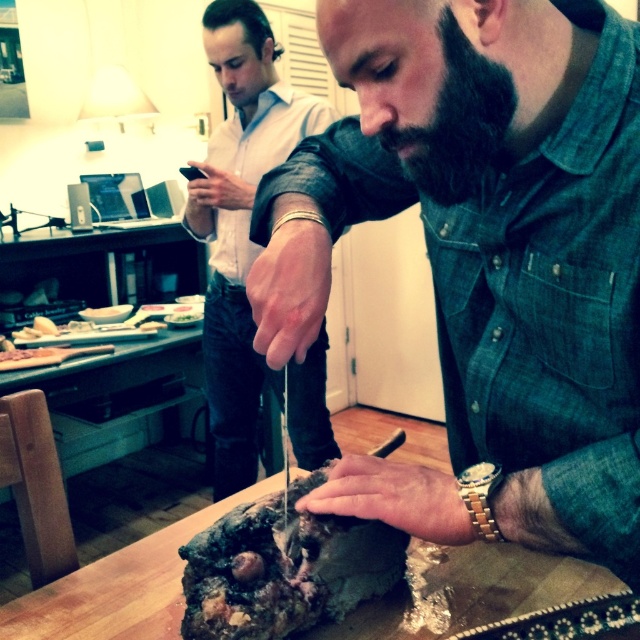
You are a chef in a kitchen and need to reach the dark brown crumbly cake at center. Your black fuzzy beard at center might interfere. Can you safely reach the cake without touching your beard?

The dark brown crumbly cake at center is 14.63 inches away from the black fuzzy beard at center. Since the distance is sufficient, you can safely reach the cake without touching your beard.

You are standing in the kitchen and need to reach the bearded man at center to ask a question. Which direction should you move relative to your current position if you are facing the kitchen entrance?

The question cannot be answered with the provided information because the 2D coordinates of the bearded man at center are given, but your current position and the kitchen entrance orientation are not specified in the scene description.